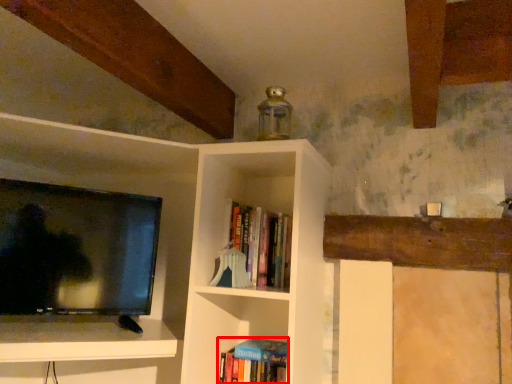
Question: From the image's perspective, considering the relative positions of book (annotated by the red box) and book in the image provided, where is book (annotated by the red box) located with respect to the staircase?

Choices:
 (A) below
 (B) above

Answer: (A)